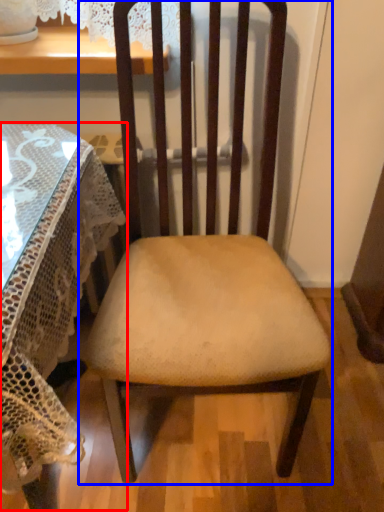
Question: Among these objects, which one is nearest to the camera, table (highlighted by a red box) or chair (highlighted by a blue box)?

Choices:
 (A) table
 (B) chair

Answer: (A)